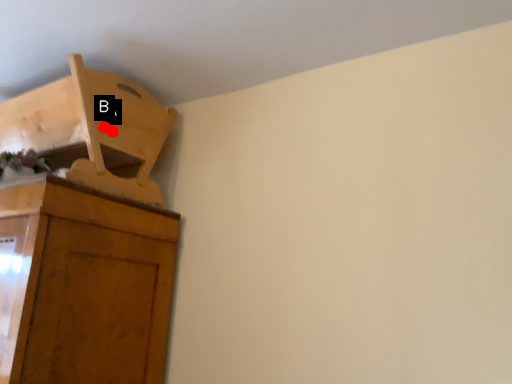
Question: Two points are circled on the image, labeled by A and B beside each circle. Which point is closer to the camera?

Choices:
 (A) A is closer
 (B) B is closer

Answer: (B)